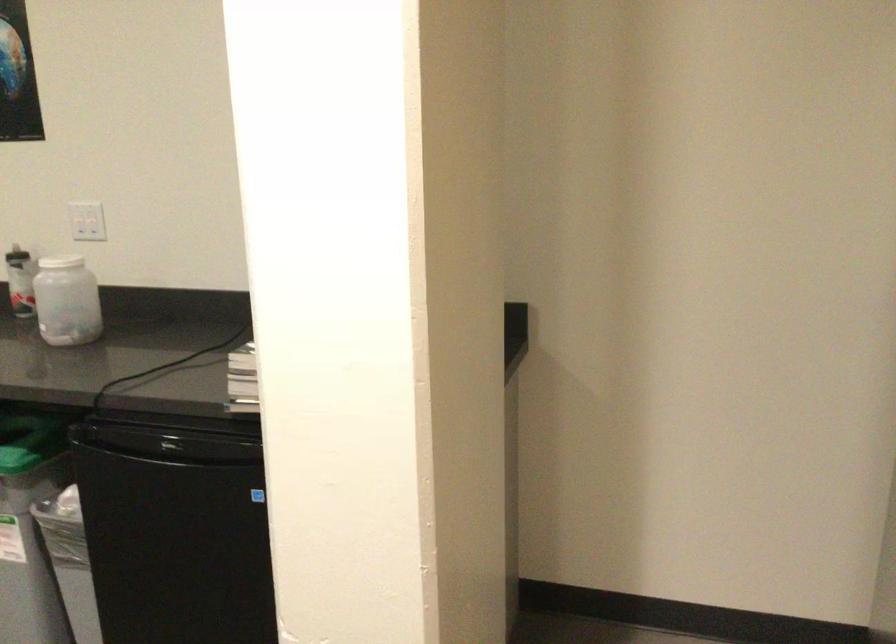
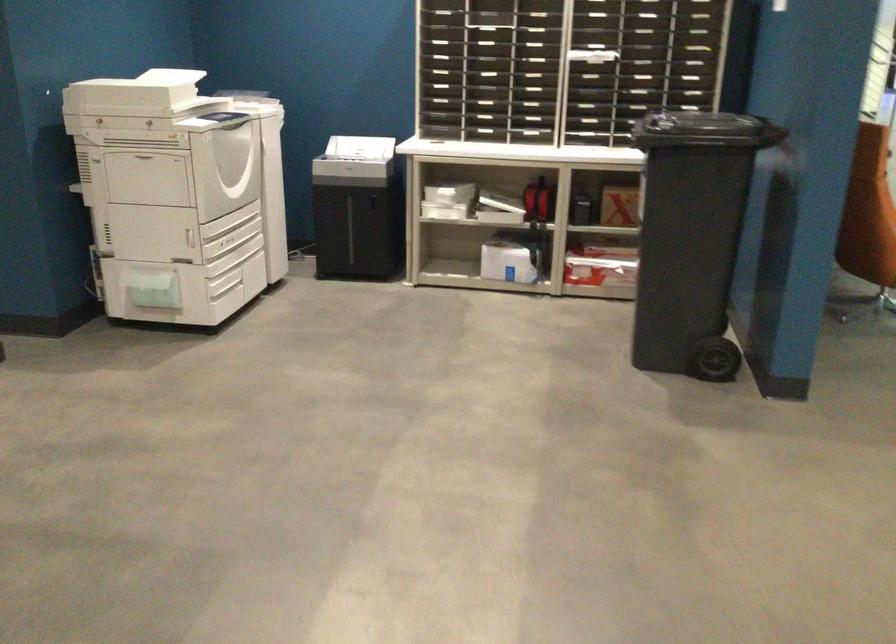
The images are taken continuously from a first-person perspective. In which direction is your viewpoint rotating?

The rotation direction of the camera is left-down.